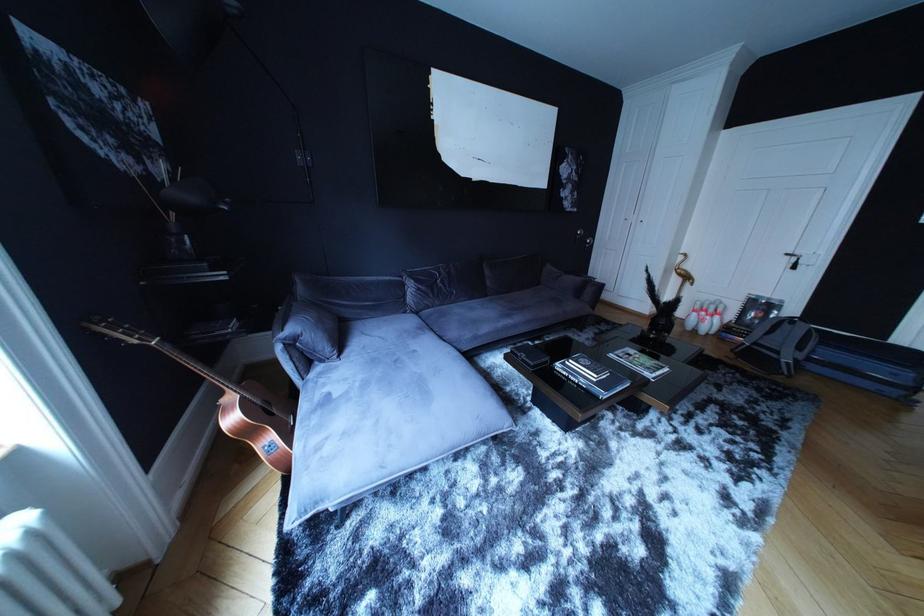
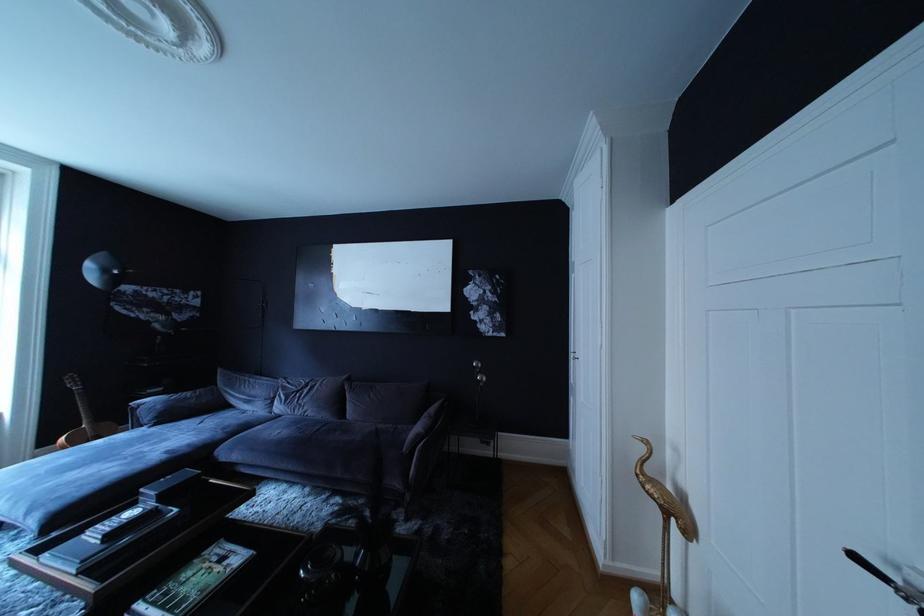
Find the pixel in the second image that matches point 638,361 in the first image.

(232, 565)